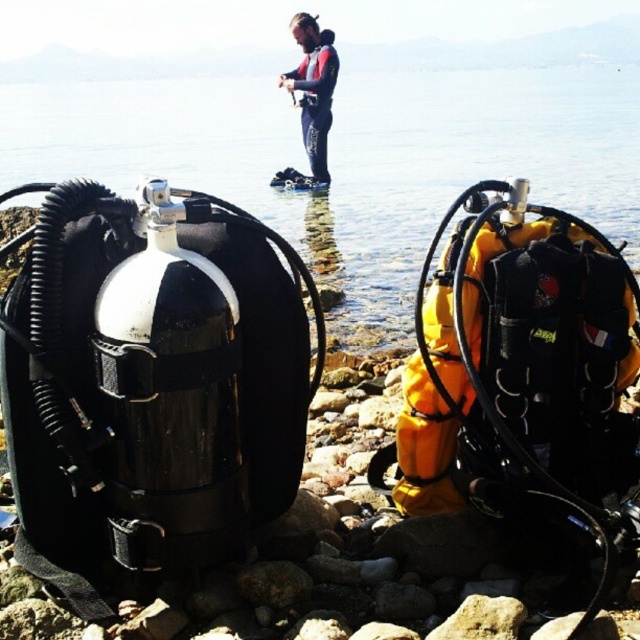
You are standing on the rocky shore where the two scuba tanks are placed. You want to step into the transparent water at center. Which direction should you move to reach it?

You should move forward towards the transparent water at center located at point (349, 160), which is in front of your current position on the rocky shore.

You are a diver preparing to enter the water. You see the transparent water at center and the red wetsuit at center. Which object is closer to your right side when facing the water?

The transparent water at center is to the right of the red wetsuit at center, so when facing the water, the transparent water at center is closer to your right side.

You are a photographer positioned at the edge of the shore. You want to take a photo that includes both the transparent water at center and the red wetsuit at center. Which object should you focus on first to ensure both are in sharp focus?

You should focus on the transparent water at center first since it is closer to you than the red wetsuit at center. By focusing on the closer object, the background object will still be in acceptable focus due to the depth of field, ensuring both are sharp.